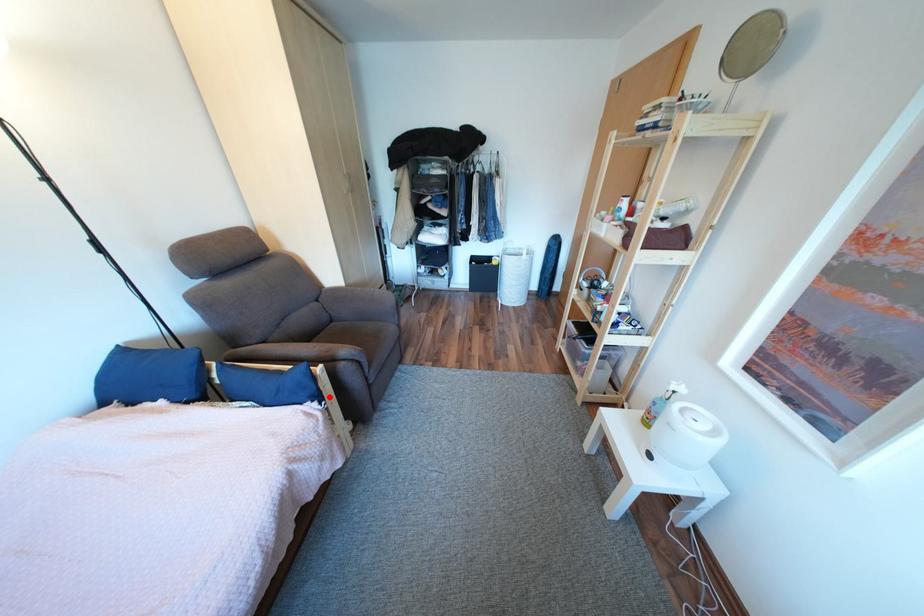
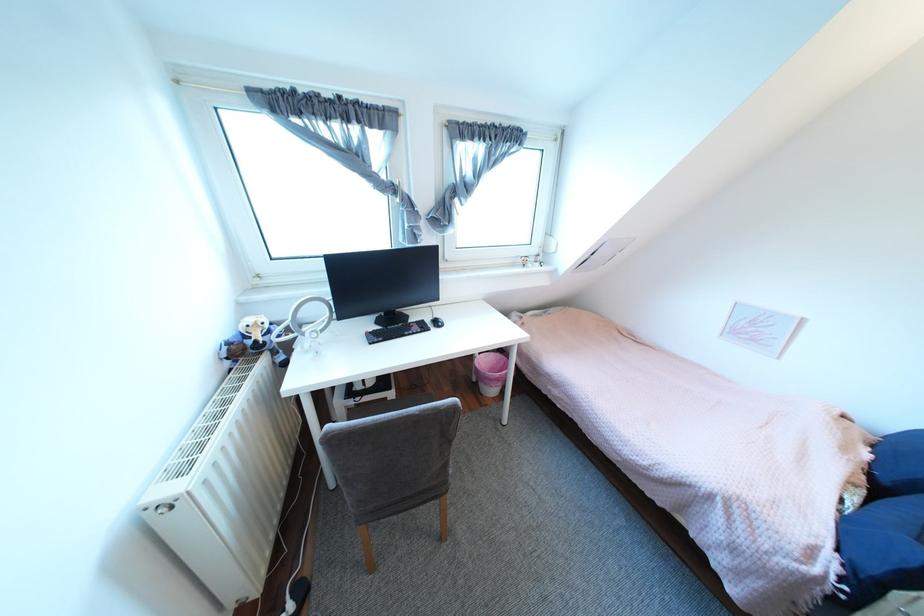
Question: A red point is marked in image1. In image2, is the corresponding 3D point closer to the camera or farther? Reply with the corresponding letter.

Choices:
 (A) The corresponding 3D point is closer.
 (B) The corresponding 3D point is farther.

Answer: (B)